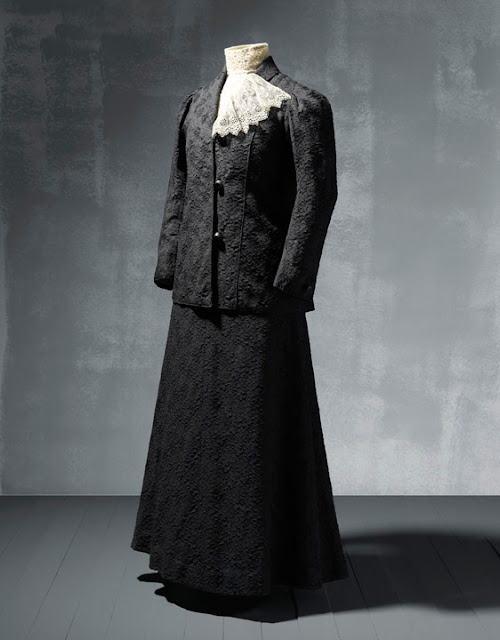
Where is `white streaks on gray wall`? The image size is (500, 640). white streaks on gray wall is located at coordinates (360, 121), (134, 294), (447, 450).